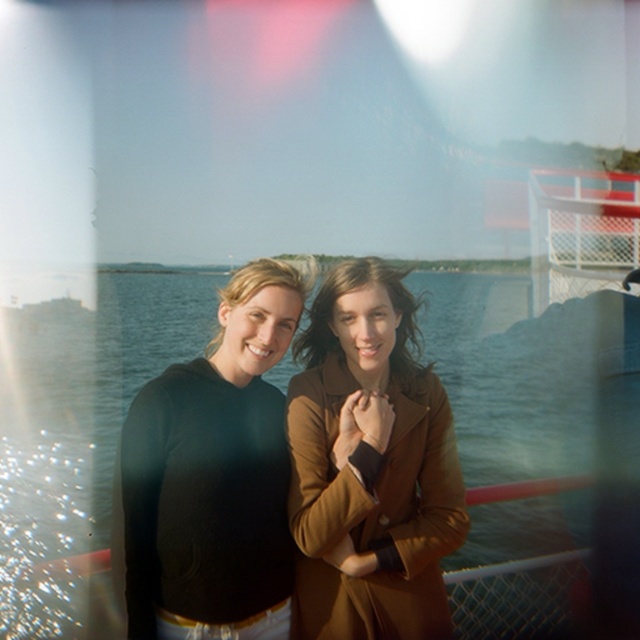
Does clear water at center come behind matte brown coat at center?

No, clear water at center is in front of matte brown coat at center.

Locate an element on the screen. The height and width of the screenshot is (640, 640). clear water at center is located at coordinates (77, 429).

Is brown leather jacket at center further to the viewer compared to matte brown coat at center?

That is False.

Which is more to the right, brown leather jacket at center or matte brown coat at center?

From the viewer's perspective, matte brown coat at center appears more on the right side.

Find the location of a particular element. brown leather jacket at center is located at coordinates (369, 467).

In order to click on brown leather jacket at center in this screenshot , I will do `click(369, 467)`.

Identify the location of black matte sweater at center. The height and width of the screenshot is (640, 640). [x=212, y=474].

Does black matte sweater at center appear over matte brown coat at center?

No.

Is point (285, 285) farther from viewer compared to point (397, 268)?

No.

At what (x,y) coordinates should I click in order to perform the action: click on black matte sweater at center. Please return your answer as a coordinate pair (x, y). The image size is (640, 640). Looking at the image, I should click on (212, 474).